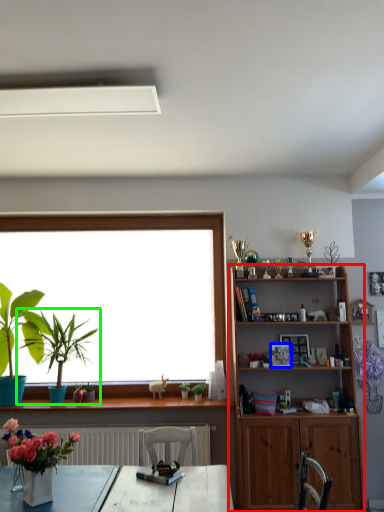
Question: Which object is the farthest from shelf (highlighted by a red box)? Choose among these: picture frame (highlighted by a blue box) or houseplant (highlighted by a green box).

Choices:
 (A) picture frame
 (B) houseplant

Answer: (B)